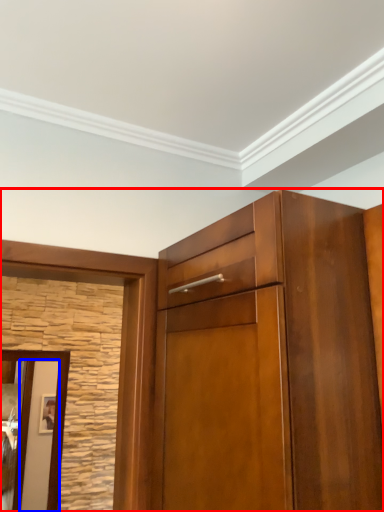
Question: Which object appears closest to the camera in this image, cupboard (highlighted by a red box) or door (highlighted by a blue box)?

Choices:
 (A) cupboard
 (B) door

Answer: (A)